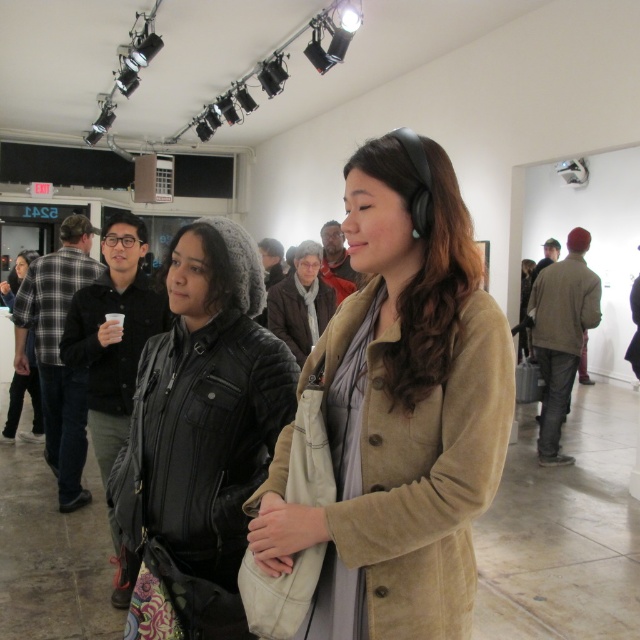
Question: Which point is farther to the camera?

Choices:
 (A) black quilted jacket at center
 (B) suede beige coat at center

Answer: (A)

Question: Can you confirm if suede beige coat at center is positioned to the right of black quilted jacket at center?

Choices:
 (A) no
 (B) yes

Answer: (B)

Question: Is suede beige coat at center smaller than black quilted jacket at center?

Choices:
 (A) yes
 (B) no

Answer: (A)

Question: Does suede beige coat at center have a greater width compared to black quilted jacket at center?

Choices:
 (A) no
 (B) yes

Answer: (A)